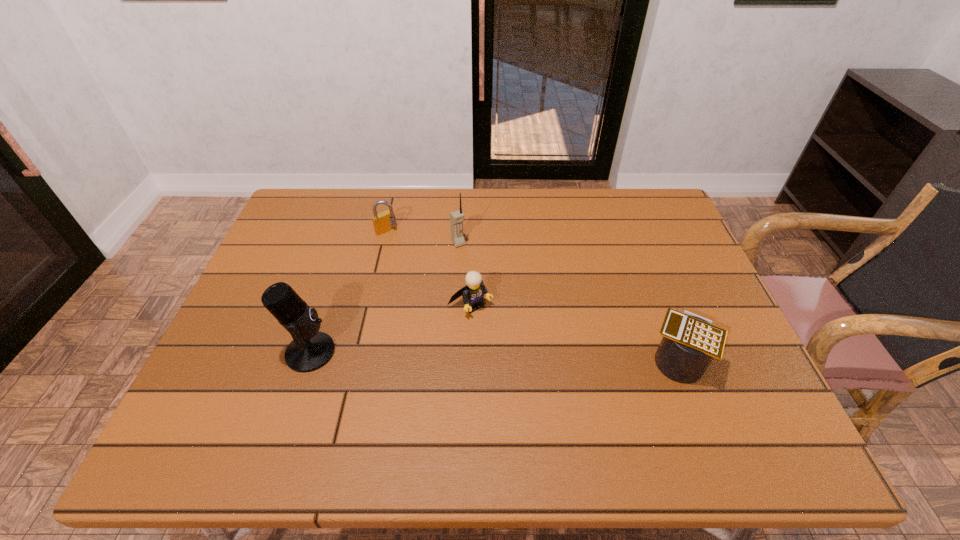
In the image, there is a desktop. Identify the location of free space at the near right corner. (732, 391).

The height and width of the screenshot is (540, 960). Identify the location of free area in between the calculator and the leftmost object. (493, 356).

This screenshot has width=960, height=540. In order to click on vacant space that is in between the microphone and the rightmost object in this screenshot , I will do `click(493, 356)`.

Where is `vacant region between the third farthest object and the padlock`? This screenshot has height=540, width=960. vacant region between the third farthest object and the padlock is located at coordinates (428, 267).

The width and height of the screenshot is (960, 540). I want to click on free space between the third farthest object and the farthest object, so click(x=428, y=267).

Find the location of a particular element. The height and width of the screenshot is (540, 960). vacant space that is in between the cellular telephone and the padlock is located at coordinates (422, 237).

The image size is (960, 540). Identify the location of free space between the leftmost object and the Lego. [391, 328].

Identify the location of free area in between the cellular telephone and the leftmost object. (384, 298).

This screenshot has height=540, width=960. In order to click on vacant space in between the calculator and the microphone in this screenshot , I will do `click(493, 356)`.

Where is `vacant area that lies between the calculator and the second object from left to right`? The image size is (960, 540). vacant area that lies between the calculator and the second object from left to right is located at coordinates (532, 295).